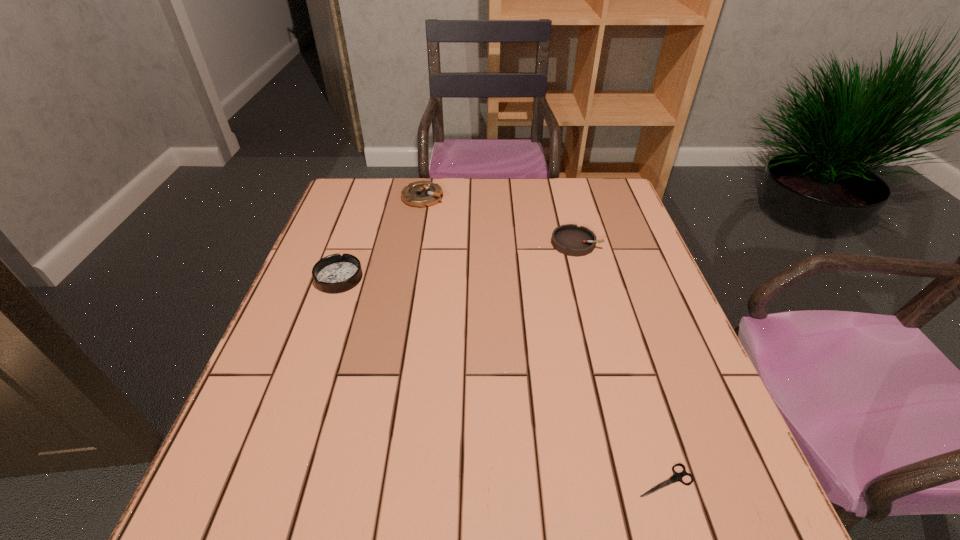
Locate an element on the screen. This screenshot has width=960, height=540. free space between the shortest object and the third object from right to left is located at coordinates (544, 339).

The width and height of the screenshot is (960, 540). Find the location of `free spot between the shortest object and the second nearest object`. free spot between the shortest object and the second nearest object is located at coordinates (502, 379).

At what (x,y) coordinates should I click in order to perform the action: click on vacant area between the second farthest ashtray and the shortest object. Please return your answer as a coordinate pair (x, y). Looking at the image, I should click on (620, 361).

Image resolution: width=960 pixels, height=540 pixels. Identify the location of free space between the second nearest object and the nearest object. (502, 379).

The width and height of the screenshot is (960, 540). Identify the location of object that stands as the closest to the nearest object. (569, 239).

Find the location of a particular element. The width and height of the screenshot is (960, 540). object that can be found as the second closest to the farthest ashtray is located at coordinates (569, 239).

Find the location of `ashtray that is the second closest to the farthest ashtray`. ashtray that is the second closest to the farthest ashtray is located at coordinates coord(569,239).

Locate which ashtray ranks in proximity to the third object from right to left. Please provide its 2D coordinates. Your answer should be formatted as a tuple, i.e. [(x, y)], where the tuple contains the x and y coordinates of a point satisfying the conditions above.

[(335, 273)]

This screenshot has width=960, height=540. In order to click on free point that satisfies the following two spatial constraints: 1. on the back side of the second farthest ashtray; 2. on the left side of the third farthest object in this screenshot , I will do `click(351, 243)`.

You are a GUI agent. You are given a task and a screenshot of the screen. Output one action in this format:
    pyautogui.click(x=<x>, y=<y>)
    Task: Click on the vacant area in the image that satisfies the following two spatial constraints: 1. on the back side of the leftmost object; 2. on the right side of the second ashtray from left to right
    Image resolution: width=960 pixels, height=540 pixels.
    Given the screenshot: What is the action you would take?
    pyautogui.click(x=368, y=197)